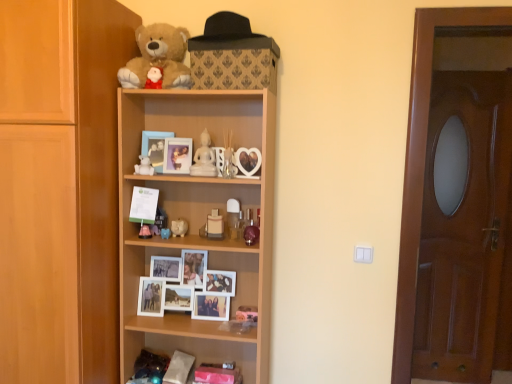
Find the location of a particular element. Image resolution: width=512 pixels, height=384 pixels. free spot above white wooden photo frames at center, positioned as the 1th shelf in bottom-to-top order (from a real-world perspective) is located at coordinates (183, 250).